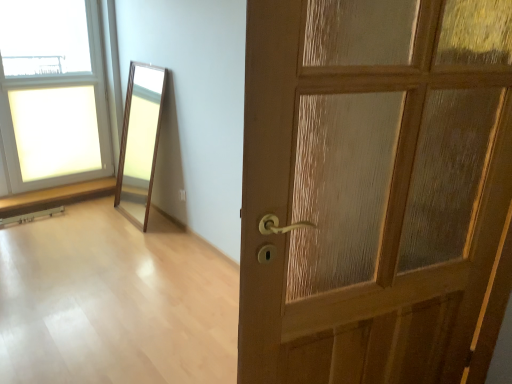
This screenshot has height=384, width=512. Identify the location of blank space above wooden floor at center (from a real-world perspective). (88, 265).